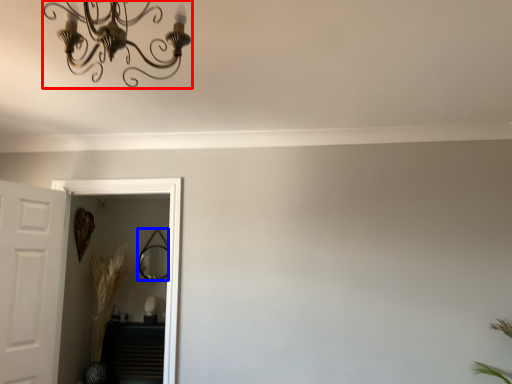
Question: Which point is further to the camera, light fixture (highlighted by a red box) or mirror (highlighted by a blue box)?

Choices:
 (A) light fixture
 (B) mirror

Answer: (B)